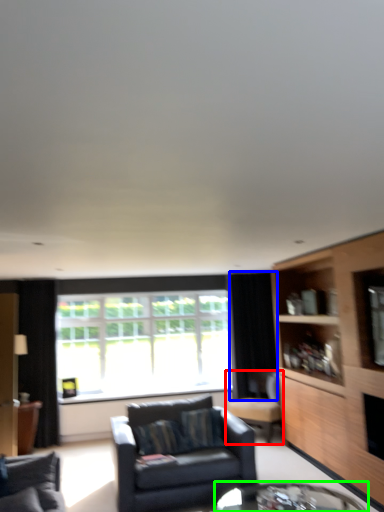
Question: Estimate the real-world distances between objects in this image. Which object is closer to chair (highlighted by a red box), curtain (highlighted by a blue box) or table (highlighted by a green box)?

Choices:
 (A) curtain
 (B) table

Answer: (A)